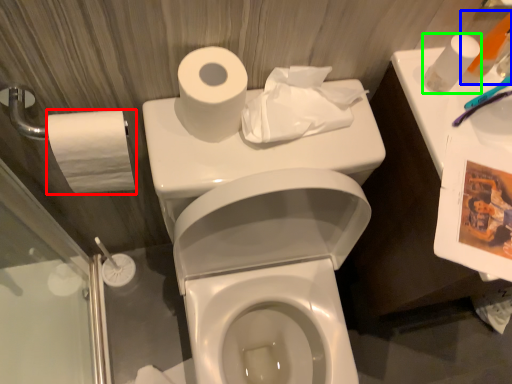
Question: Which object is the farthest from toilet paper (highlighted by a red box)? Choose among these: toiletry (highlighted by a blue box) or toilet paper (highlighted by a green box).

Choices:
 (A) toiletry
 (B) toilet paper

Answer: (A)